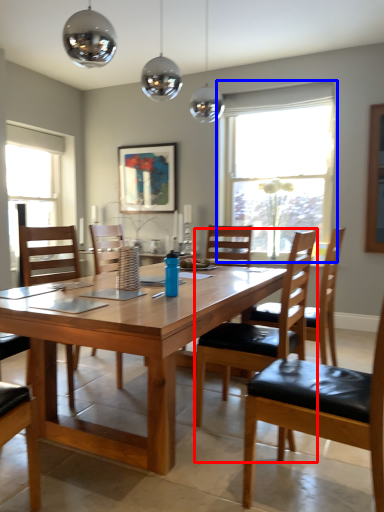
Question: Among these objects, which one is farthest to the camera, chair (highlighted by a red box) or window (highlighted by a blue box)?

Choices:
 (A) chair
 (B) window

Answer: (B)